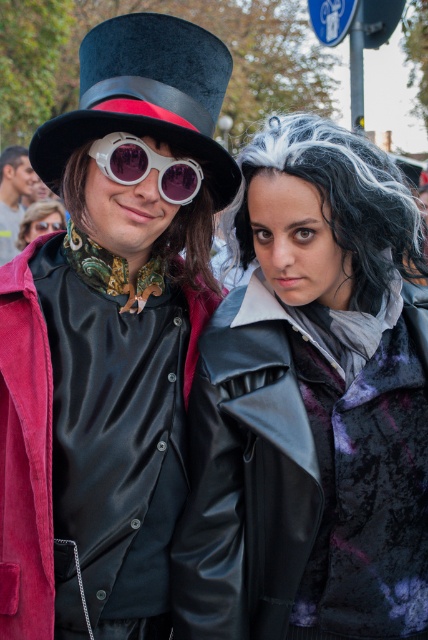
Does point (369, 262) lie in front of point (32, 220)?

Yes, point (369, 262) is in front of point (32, 220).

Which is in front, point (228, 243) or point (45, 218)?

Point (228, 243)

This screenshot has width=428, height=640. In order to click on gray synthetic wig at center in this screenshot , I will do `click(336, 200)`.

Does point (121, 100) come behind point (109, 193)?

No, (121, 100) is in front of (109, 193).

Between point (38, 141) and point (157, 145), which one is positioned in front?

Point (38, 141) is in front.

What are the coordinates of `black velvet dress hat at upper center` in the screenshot? It's located at (145, 97).

Can you confirm if black velvet dress hat at upper center is thinner than matte black coat at center?

Yes.

Does black velvet dress hat at upper center have a greater height compared to matte black coat at center?

Incorrect, black velvet dress hat at upper center's height is not larger of matte black coat at center's.

Which is behind, point (208, 106) or point (64, 216)?

Point (64, 216)

Identify the location of black velvet dress hat at upper center. (145, 97).